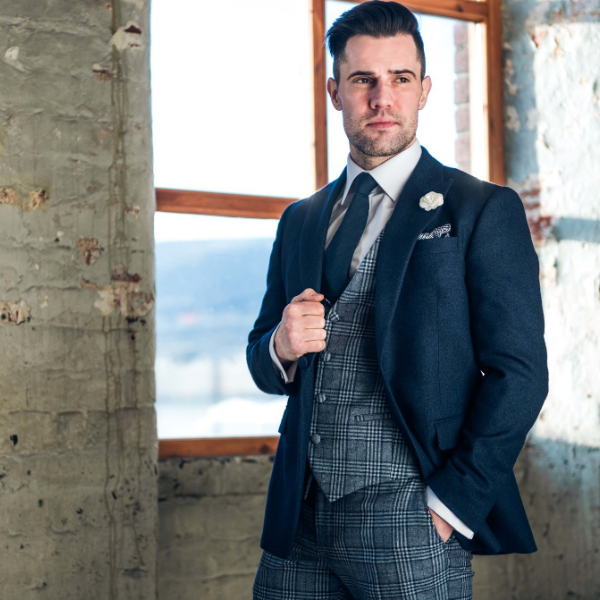
Find the location of `window`. window is located at coordinates (219, 129).